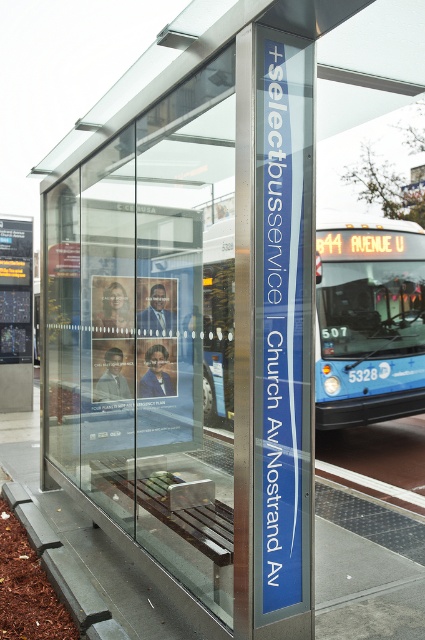
Which is more to the left, blue metallic bus at center or gray concrete curb at lower left?

gray concrete curb at lower left is more to the left.

Does blue metallic bus at center lie in front of gray concrete curb at lower left?

That is False.

Is point (382, 328) less distant than point (27, 532)?

No, (382, 328) is further to viewer.

Find the location of `blue metallic bus at center`. blue metallic bus at center is located at coordinates (368, 323).

How distant is blue metallic bus at center from brown wooden bench at lower center?

blue metallic bus at center is 4.32 meters from brown wooden bench at lower center.

Who is higher up, blue metallic bus at center or brown wooden bench at lower center?

blue metallic bus at center is higher up.

Which is behind, point (365, 337) or point (353, 552)?

Positioned behind is point (365, 337).

Where is `blue metallic bus at center`? This screenshot has height=640, width=425. blue metallic bus at center is located at coordinates (368, 323).

Is point (340, 516) farther from camera compared to point (93, 616)?

Yes, point (340, 516) is farther from viewer.

Between brown wooden bench at lower center and gray concrete curb at lower left, which one is positioned lower?

brown wooden bench at lower center

The width and height of the screenshot is (425, 640). What do you see at coordinates (367, 566) in the screenshot? I see `brown wooden bench at lower center` at bounding box center [367, 566].

You are a GUI agent. You are given a task and a screenshot of the screen. Output one action in this format:
    pyautogui.click(x=<x>, y=<y>)
    Task: Click on the brown wooden bench at lower center
    
    Given the screenshot: What is the action you would take?
    pyautogui.click(x=367, y=566)